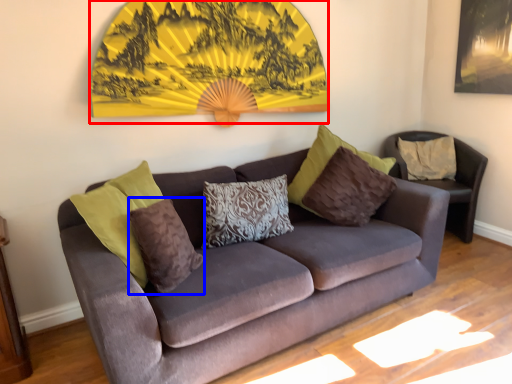
Question: Among these objects, which one is nearest to the camera, decor (highlighted by a red box) or pillow (highlighted by a blue box)?

Choices:
 (A) decor
 (B) pillow

Answer: (B)